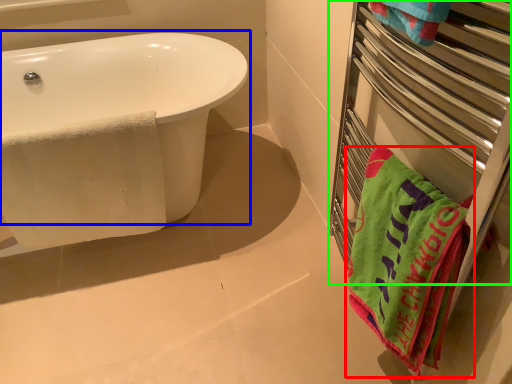
Question: Considering the real-world distances, which object is closest to towel (highlighted by a red box)? bathtub (highlighted by a blue box) or balustrade (highlighted by a green box).

Choices:
 (A) bathtub
 (B) balustrade

Answer: (B)